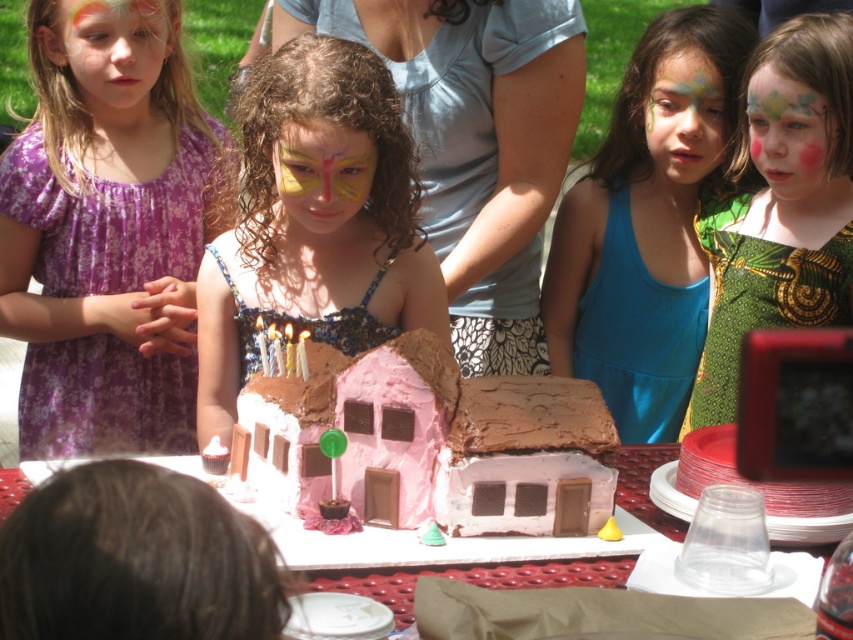
You are a guest at the birthday party and want to take a photo of the cake. The matte pink cake at center and the pink chocolate house at center are both on the table. Which object should you focus on if you want to capture the taller one in your photo?

The pink chocolate house at center is taller than the matte pink cake at center, so you should focus on the pink chocolate house at center to capture the taller one in your photo.

You are a photographer at the birthday party. You want to take a photo of the blue fabric dress at center and the pink chocolate house at center. Which object should you focus on first if you want to capture both in the same frame without moving the camera?

The blue fabric dress at center is taller than the pink chocolate house at center, so you should focus on the blue fabric dress at center first to ensure both are in focus.

Based on the photo, you are a photographer at the birthday party and want to take a photo of the pink chocolate house at center and the matte green face paint at center. Which object should you focus on first to ensure both are in sharp focus?

You should focus on the pink chocolate house at center first because it is closer to the viewer than the matte green face paint at center, so adjusting focus from near to far will help both be in sharp focus.